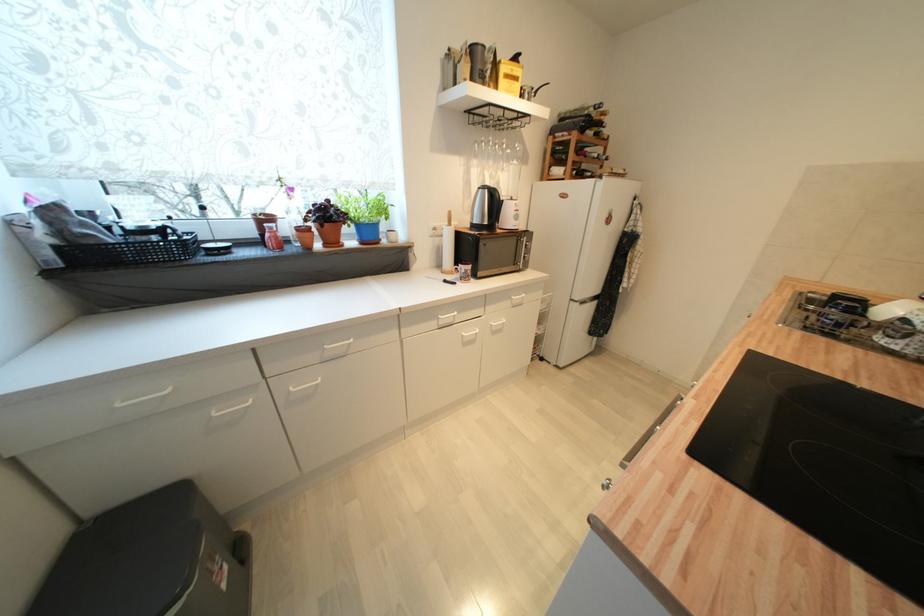
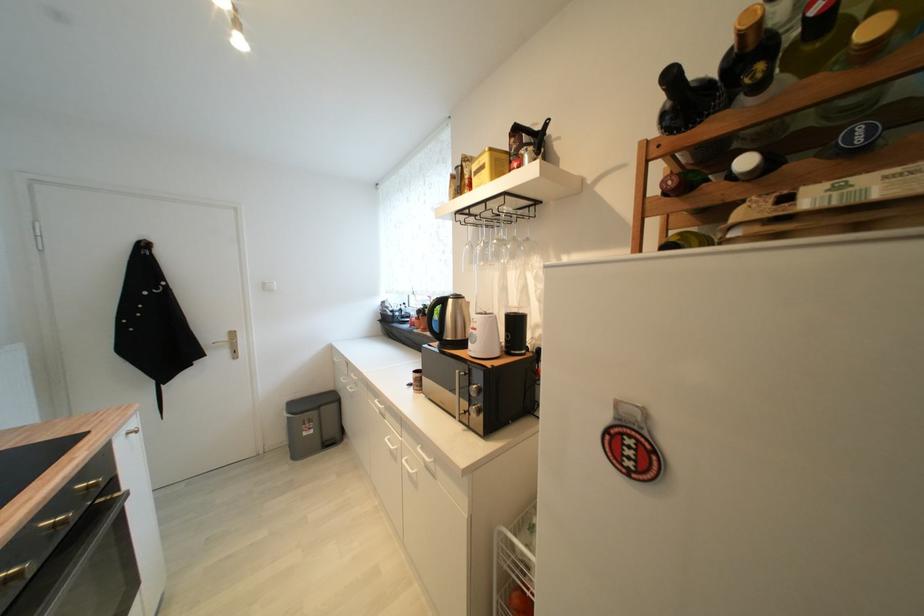
Find the pixel in the second image that matches point (228, 588) in the first image.

(310, 436)